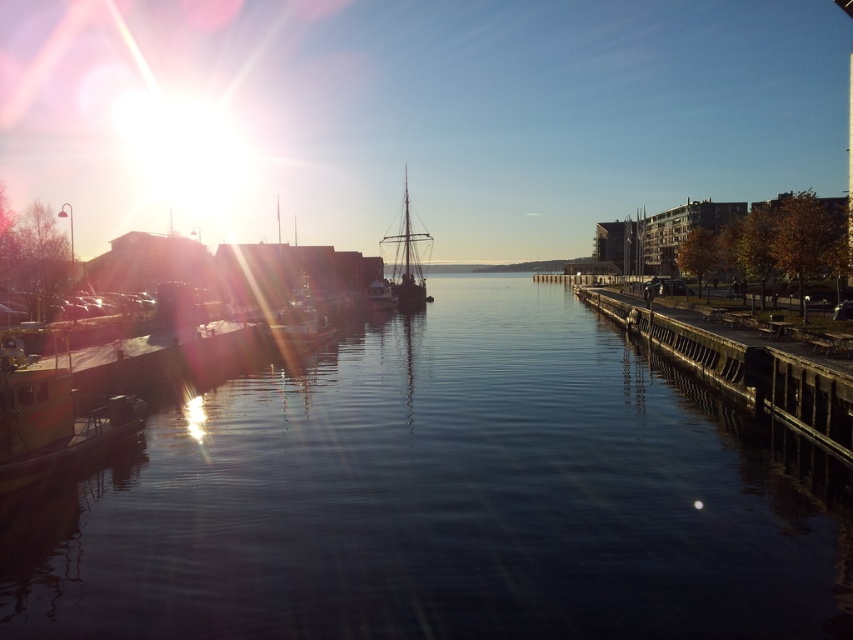
Does dark gray concrete dock at center have a greater height compared to silhouetted wooden ship at center?

No, dark gray concrete dock at center is not taller than silhouetted wooden ship at center.

In the scene shown: Is dark gray concrete dock at center below silhouetted wooden ship at center?

Indeed, dark gray concrete dock at center is positioned under silhouetted wooden ship at center.

Identify the location of dark gray concrete dock at center. (747, 371).

Which is above, dark water at center or dark gray concrete dock at center?

dark gray concrete dock at center is above.

Is point (341, 572) more distant than point (782, 356)?

No.

Is point (675, 500) in front of point (621, 316)?

Yes, point (675, 500) is closer to viewer.

The height and width of the screenshot is (640, 853). In order to click on dark water at center in this screenshot , I will do `click(445, 497)`.

Locate an element on the screen. The height and width of the screenshot is (640, 853). dark water at center is located at coordinates (445, 497).

Between point (546, 636) and point (422, 234), which one is positioned in front?

Point (546, 636) is more forward.

Is point (541, 582) positioned before point (426, 241)?

Yes, it is.

Locate an element on the screen. The height and width of the screenshot is (640, 853). dark water at center is located at coordinates (445, 497).